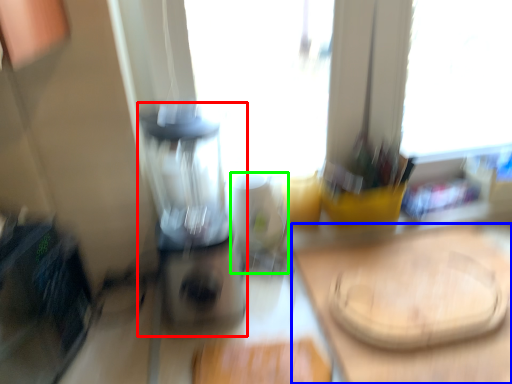
Question: Which object is the closest to the blender (highlighted by a red box)? Choose among these: counter top (highlighted by a blue box) or appliance (highlighted by a green box).

Choices:
 (A) counter top
 (B) appliance

Answer: (B)